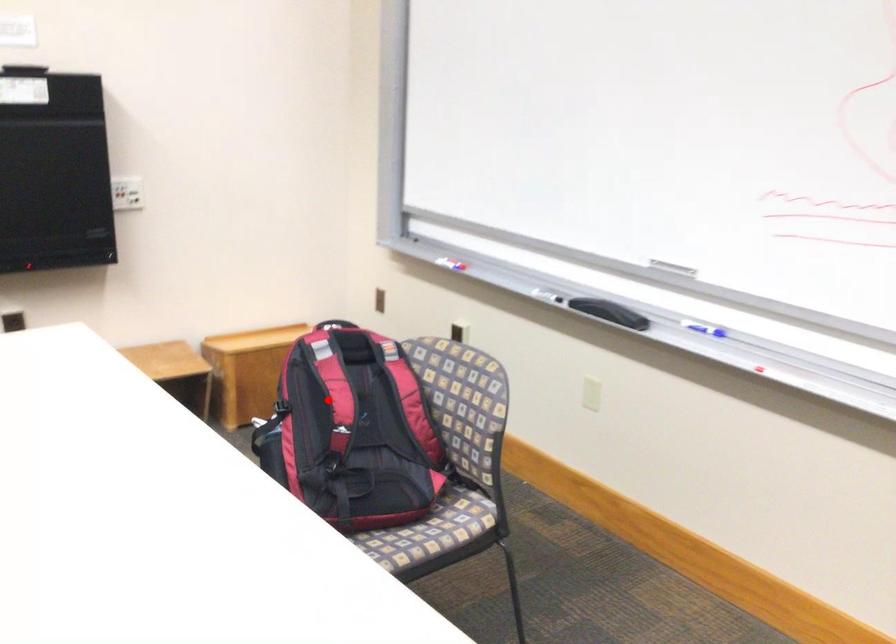
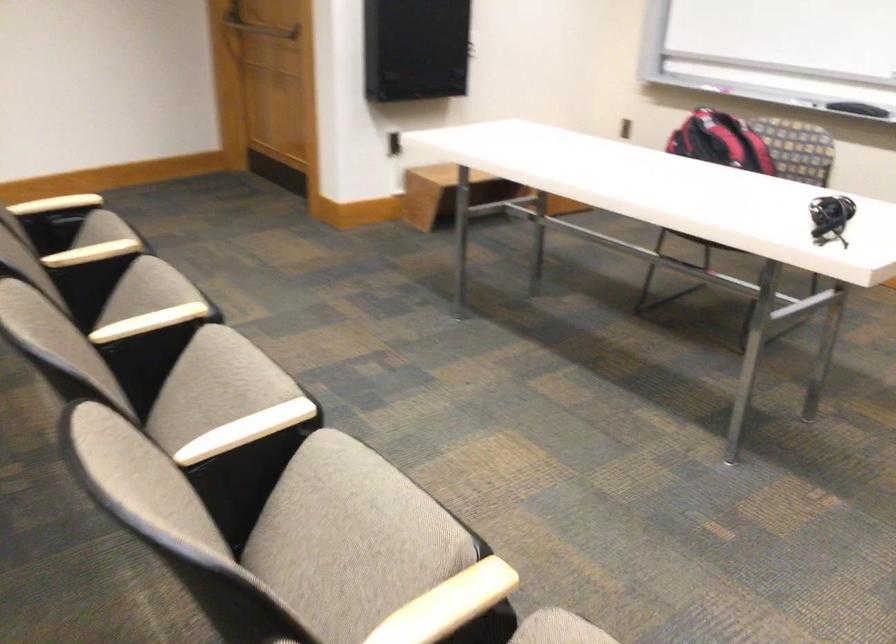
Question: A red point is marked in image1. In image2, is the corresponding 3D point closer to the camera or farther? Reply with the corresponding letter.

Choices:
 (A) The corresponding 3D point is closer.
 (B) The corresponding 3D point is farther.

Answer: (B)